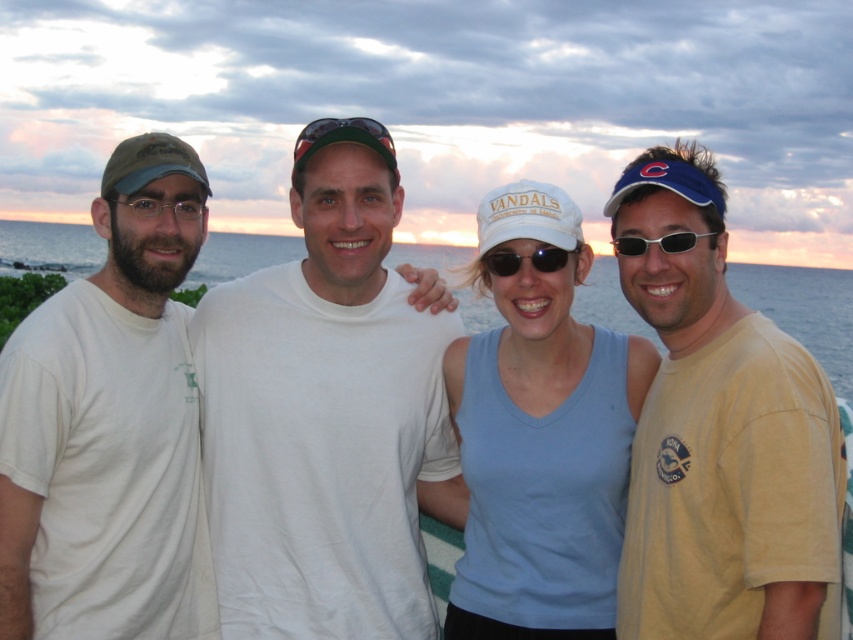
You are a photographer trying to capture a clear shot of the light blue fabric tank top at center and the sunglasses at center. Which object should you focus on first to ensure both are in focus?

The light blue fabric tank top at center is in front of the sunglasses at center, so you should focus on the light blue fabric tank top at center first to ensure both are in focus.